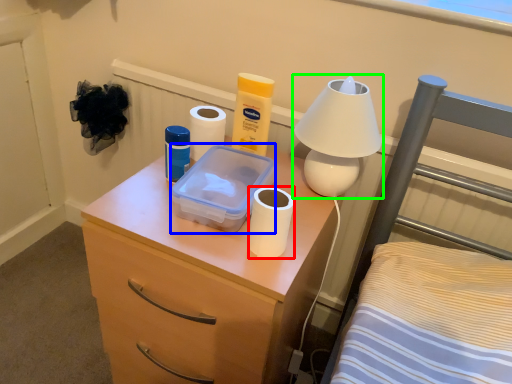
Question: Estimate the real-world distances between objects in this image. Which object is farther from toilet paper (highlighted by a red box), storage box (highlighted by a blue box) or lamp (highlighted by a green box)?

Choices:
 (A) storage box
 (B) lamp

Answer: (B)